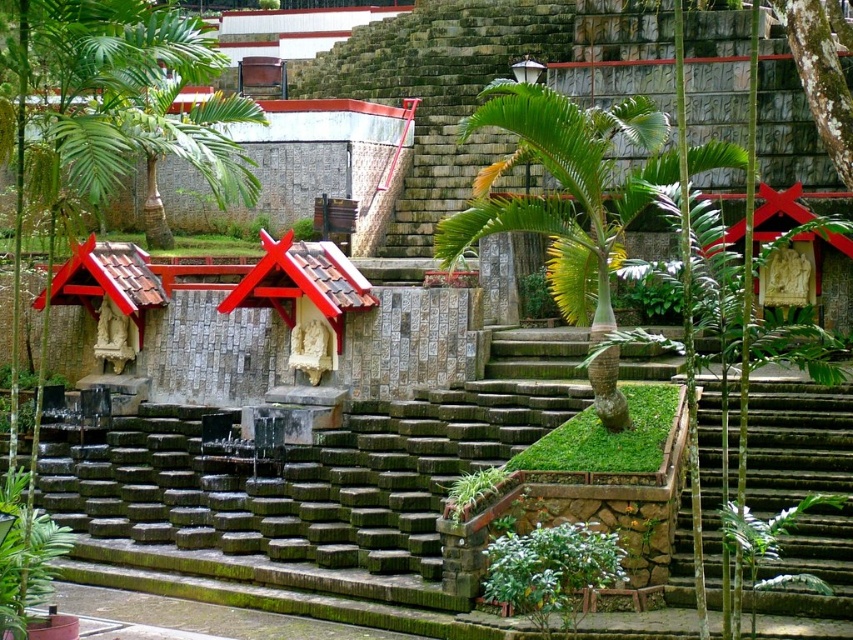
You are standing in the temple garden and want to locate the point marked at coordinates [119,102]. According to the scene description, where exactly is this point located?

The point marked at coordinates [119,102] is located on the green leafy tree at the left side of the scene.

Looking at this image, you are a visitor at this temple site and want to take a photo that includes both the green stone stairs at lower right and the green mossy bark tree at upper center. Which object should you position closer to the camera to ensure both are in frame?

Since the green stone stairs at lower right is larger in size than the green mossy bark tree at upper center, you should position the green stone stairs at lower right closer to the camera to balance their sizes in the photo.